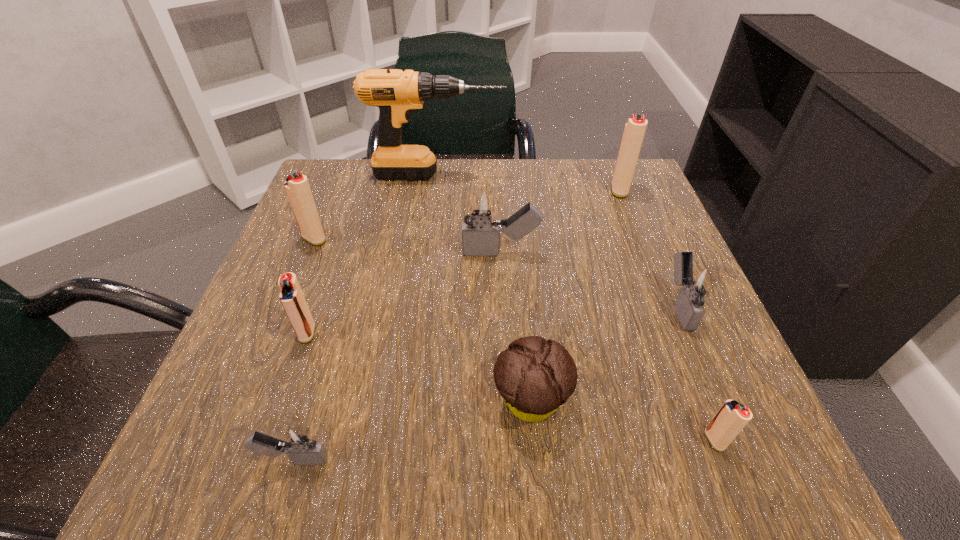
In order to click on free spot between the biggest gray igniter and the third red igniter from right to left in this screenshot , I will do `click(404, 293)`.

The width and height of the screenshot is (960, 540). Identify the location of vacant point located between the second nearest red igniter and the biggest gray igniter. (404, 293).

At what (x,y) coordinates should I click in order to perform the action: click on vacant area between the drill and the biggest red igniter. Please return your answer as a coordinate pair (x, y). The image size is (960, 540). Looking at the image, I should click on (528, 183).

This screenshot has width=960, height=540. I want to click on vacant space that's between the drill and the second nearest gray igniter, so click(x=558, y=240).

This screenshot has height=540, width=960. Find the location of `vacant area between the second smallest gray igniter and the drill`. vacant area between the second smallest gray igniter and the drill is located at coordinates (558, 240).

Find the location of a particular element. The height and width of the screenshot is (540, 960). free space between the third smallest red igniter and the smallest gray igniter is located at coordinates (304, 349).

The image size is (960, 540). In order to click on free space that is in between the fourth igniter from left to right and the muffin in this screenshot , I will do `click(516, 327)`.

At what (x,y) coordinates should I click in order to perform the action: click on free space that is in between the chocolate muffin and the smallest red igniter. Please return your answer as a coordinate pair (x, y). The width and height of the screenshot is (960, 540). Looking at the image, I should click on (623, 421).

Locate an element on the screen. This screenshot has height=540, width=960. object that is the sixth closest to the smallest gray igniter is located at coordinates 696,282.

Select which object appears as the fourth closest to the muffin. Please provide its 2D coordinates. Your answer should be formatted as a tuple, i.e. [(x, y)], where the tuple contains the x and y coordinates of a point satisfying the conditions above.

[(479, 206)]